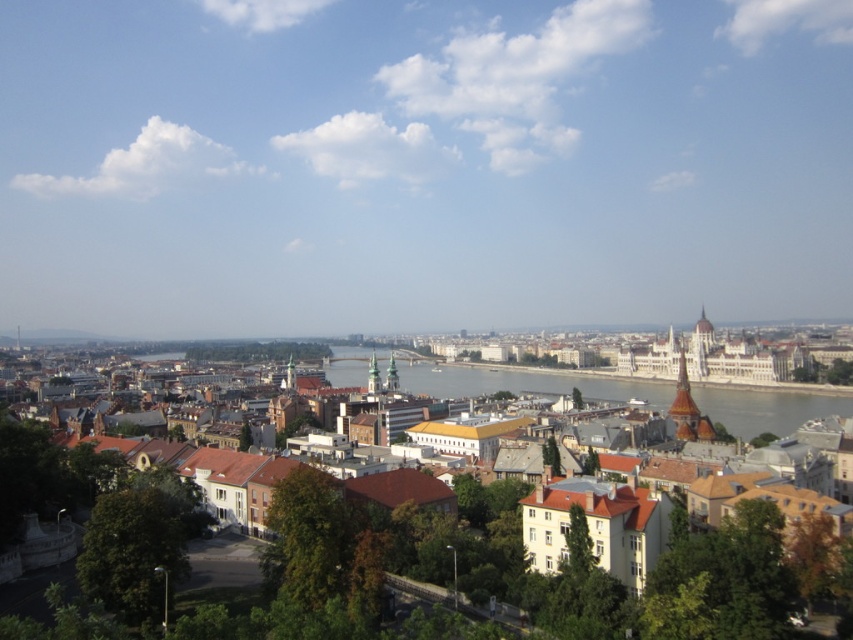
Which is more to the right, brown textured buildings at center or greenish water at center?

Positioned to the right is greenish water at center.

Is point (758, 388) less distant than point (473, 371)?

Yes.

Locate an element on the screen. The image size is (853, 640). brown textured buildings at center is located at coordinates (529, 381).